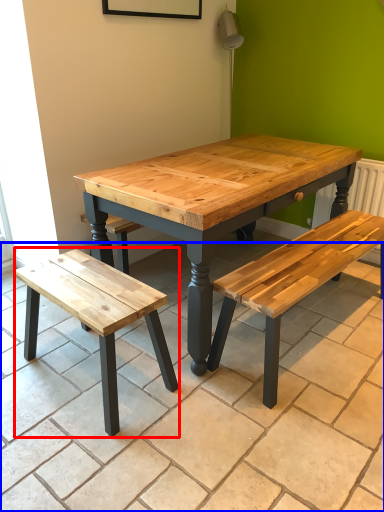
Question: Which of the following is the closest to the observer, bench (highlighted by a red box) or tile (highlighted by a blue box)?

Choices:
 (A) bench
 (B) tile

Answer: (B)